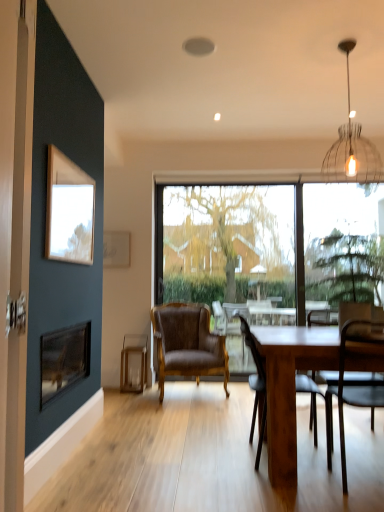
Question: Considering the relative sizes of white paper at upper left, positioned as the first picture frame in back-to-front order, and wooden table at center in the image provided, is white paper at upper left, positioned as the first picture frame in back-to-front order, smaller than wooden table at center?

Choices:
 (A) yes
 (B) no

Answer: (A)

Question: From the image's perspective, is white paper at upper left, positioned as the first picture frame in back-to-front order, beneath wooden table at center?

Choices:
 (A) yes
 (B) no

Answer: (B)

Question: Considering the relative sizes of white paper at upper left, which is the 2th picture frame in front-to-back order, and wooden table at center in the image provided, is white paper at upper left, which is the 2th picture frame in front-to-back order, taller than wooden table at center?

Choices:
 (A) yes
 (B) no

Answer: (B)

Question: Does white paper at upper left, positioned as the first picture frame in back-to-front order, appear on the right side of wooden table at center?

Choices:
 (A) yes
 (B) no

Answer: (B)

Question: From the image's perspective, is white paper at upper left, which is the 2th picture frame in front-to-back order, over wooden table at center?

Choices:
 (A) no
 (B) yes

Answer: (B)

Question: Can you confirm if transparent glass window at center is wider than metallic wire pendant light at upper right?

Choices:
 (A) yes
 (B) no

Answer: (B)

Question: From a real-world perspective, is transparent glass window at center over metallic wire pendant light at upper right?

Choices:
 (A) no
 (B) yes

Answer: (A)

Question: Is transparent glass window at center further to the viewer compared to metallic wire pendant light at upper right?

Choices:
 (A) yes
 (B) no

Answer: (A)

Question: Is transparent glass window at center to the right of metallic wire pendant light at upper right from the viewer's perspective?

Choices:
 (A) no
 (B) yes

Answer: (A)

Question: Is transparent glass window at center turned away from metallic wire pendant light at upper right?

Choices:
 (A) yes
 (B) no

Answer: (B)

Question: Is transparent glass window at center shorter than metallic wire pendant light at upper right?

Choices:
 (A) no
 (B) yes

Answer: (A)

Question: Does clear glass candlestick at lower center have a smaller size compared to wooden chair at center, the 2th chair positioned from the back?

Choices:
 (A) yes
 (B) no

Answer: (A)